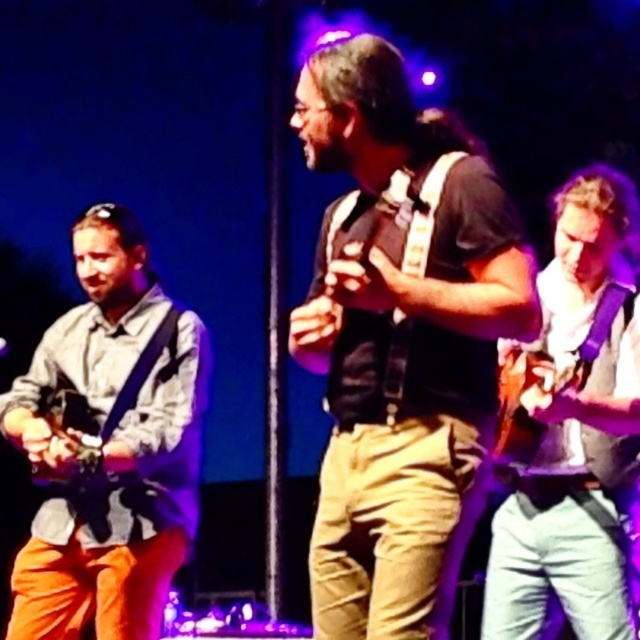
Question: Considering the real-world distances, which object is closest to the white matte guitar at right?

Choices:
 (A) matte black vest at center
 (B) light gray fabric shirt at left

Answer: (A)

Question: Is matte black vest at center to the left of light gray fabric shirt at left from the viewer's perspective?

Choices:
 (A) no
 (B) yes

Answer: (A)

Question: Can you confirm if matte black vest at center is positioned above light gray fabric shirt at left?

Choices:
 (A) no
 (B) yes

Answer: (B)

Question: Based on their relative distances, which object is farther from the white matte guitar at right?

Choices:
 (A) light gray fabric shirt at left
 (B) matte black vest at center

Answer: (A)

Question: Is light gray fabric shirt at left smaller than white matte guitar at right?

Choices:
 (A) no
 (B) yes

Answer: (A)

Question: Among these objects, which one is nearest to the camera?

Choices:
 (A) matte black vest at center
 (B) light gray fabric shirt at left

Answer: (A)